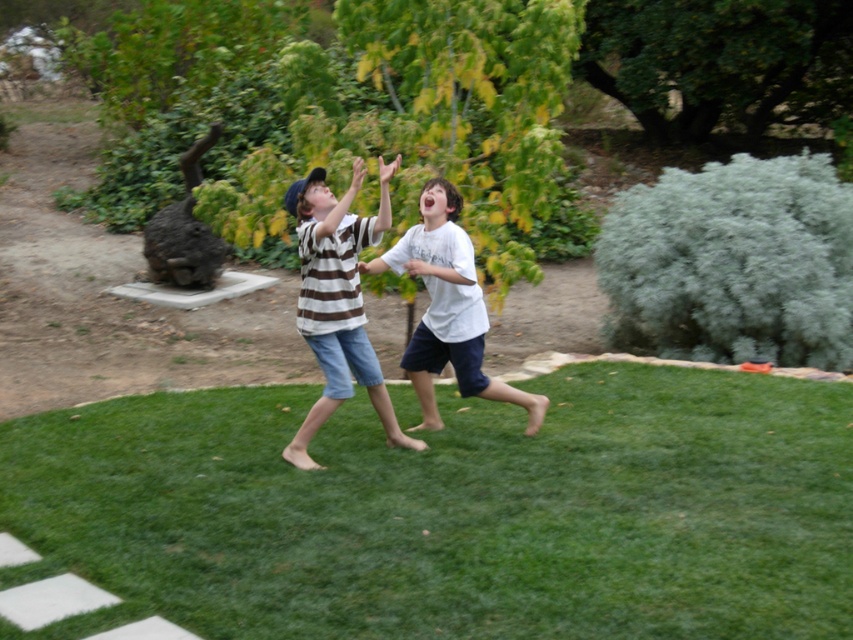
Question: Among these objects, which one is farthest from the camera?

Choices:
 (A) green grass at center
 (B) white cotton shirt at center
 (C) brown striped shirt at center

Answer: (B)

Question: Which point is farther to the camera?

Choices:
 (A) green grass at center
 (B) green leafy tree at upper center
 (C) white cotton shirt at center

Answer: (B)

Question: Which object is the farthest from the white cotton shirt at center?

Choices:
 (A) green grass at center
 (B) brown striped shirt at center
 (C) green leafy tree at upper center
 (D) gray fluffy bush at right

Answer: (C)

Question: Can you confirm if green grass at center is thinner than white cotton shirt at center?

Choices:
 (A) yes
 (B) no

Answer: (B)

Question: In this image, where is gray fluffy bush at right located relative to green leafy tree at upper center?

Choices:
 (A) right
 (B) left

Answer: (B)

Question: Does gray fluffy bush at right have a larger size compared to green leafy tree at upper center?

Choices:
 (A) yes
 (B) no

Answer: (A)